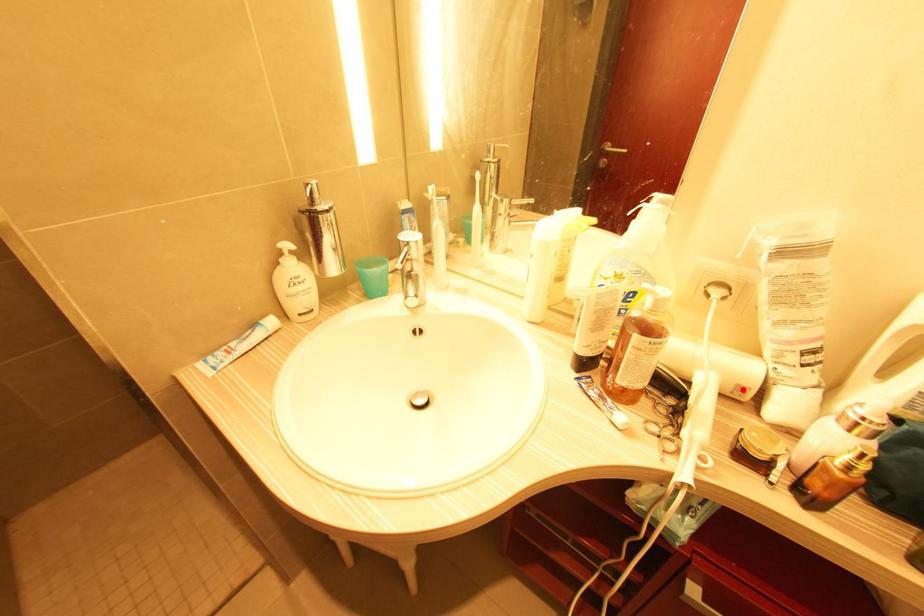
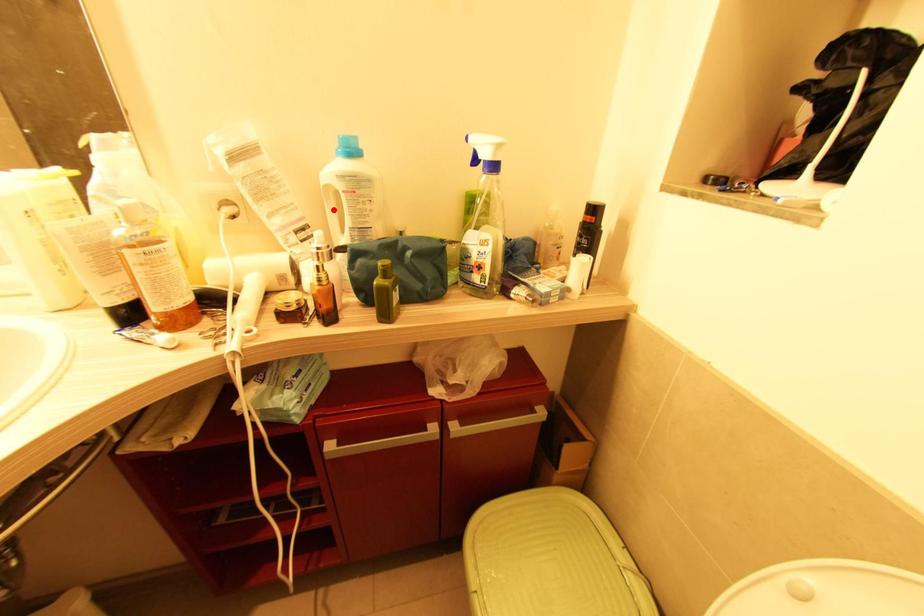
I am providing you with two images of the same scene from different viewpoints. A red point is marked on the first image and another point is marked on the second image. Does the point marked in image1 correspond to the same location as the one in image2?

No